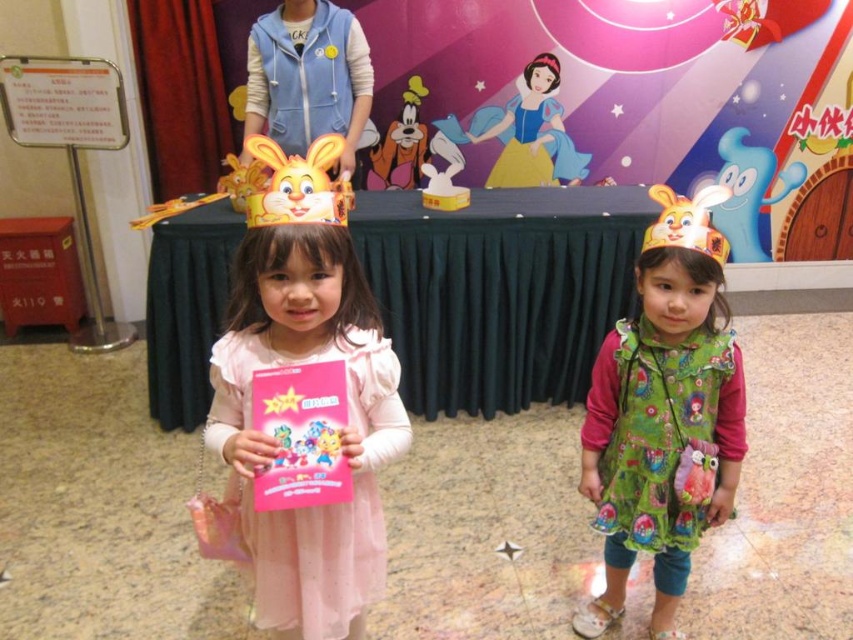
You are a photographer at a childrens party. You need to arrange the two children wearing green dresses so that the matte green dress at center is on the left side of the green fabric dress at right. Can you do that?

The matte green dress at center is currently positioned on the right side of the green fabric dress at right, so to place it on the left side, you would need to swap their positions.